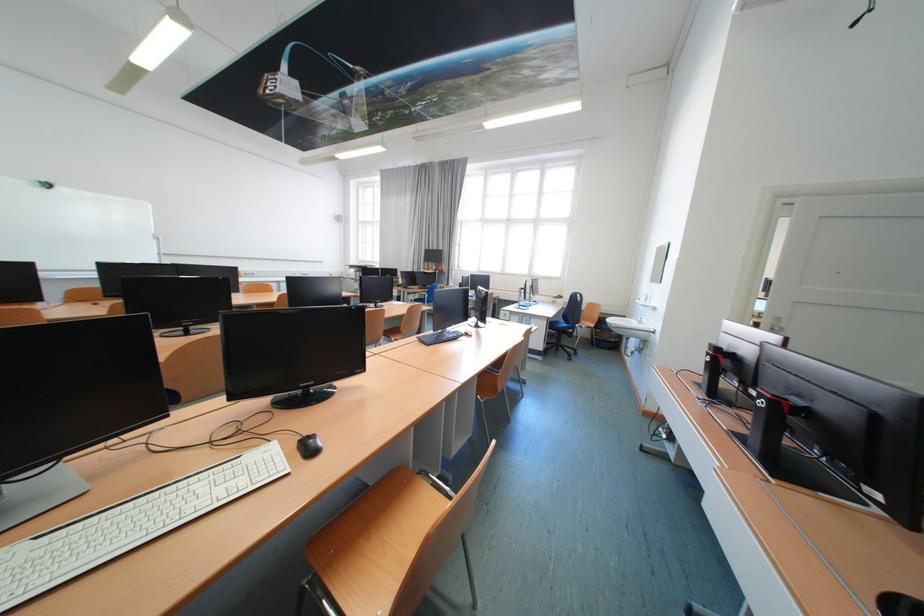
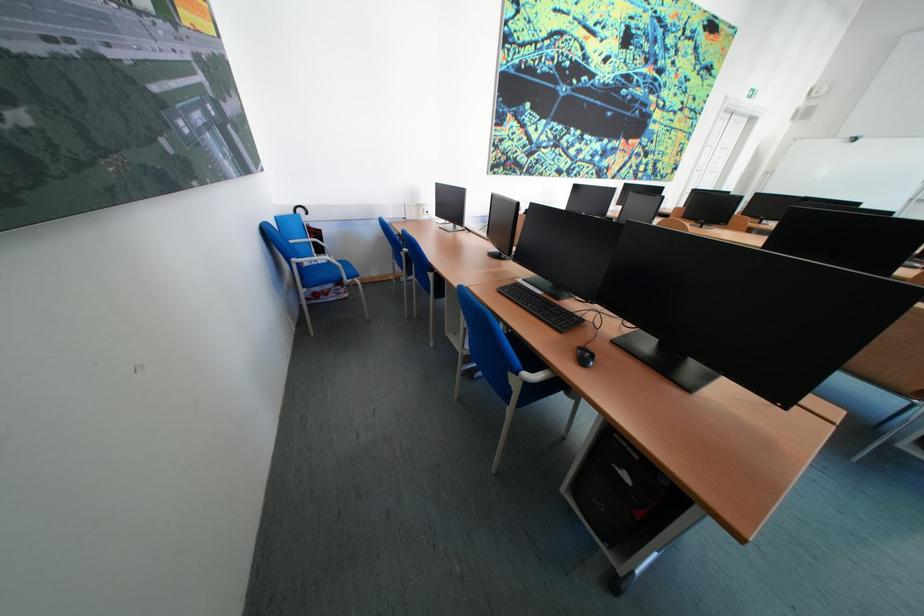
Question: I am providing you with two images of the same scene from different viewpoints. Please identify which objects are invisible in image2.

Choices:
 (A) black umbrella handle
 (B) blue chair armrest
 (C) black computer keyboard
 (D) green patterned mug

Answer: (C)